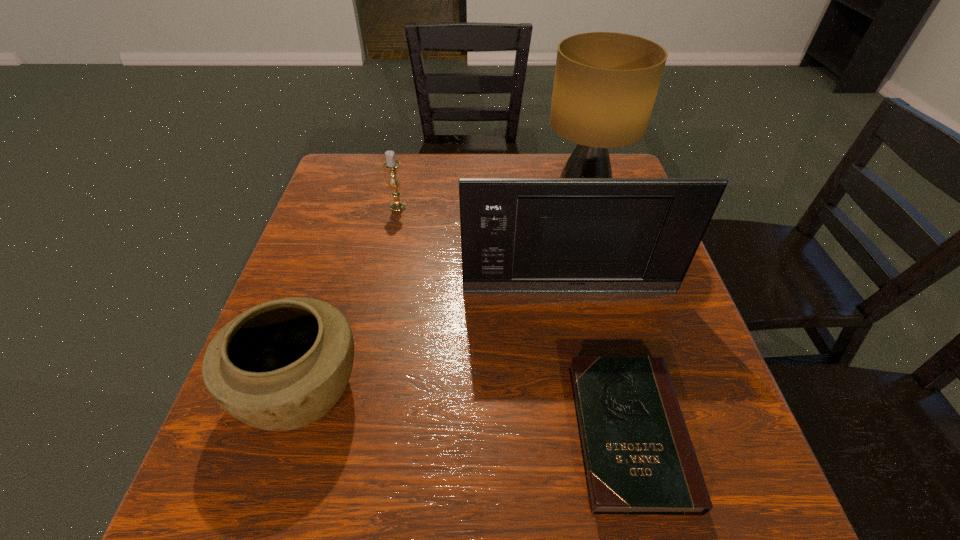
Where is `object that is the second closest to the Bible`? The width and height of the screenshot is (960, 540). object that is the second closest to the Bible is located at coordinates (281, 365).

Image resolution: width=960 pixels, height=540 pixels. I want to click on object that stands as the closest to the second tallest object, so click(638, 456).

Identify the location of vacant space that satisfies the following two spatial constraints: 1. on the back side of the tallest object; 2. on the left side of the Bible. (572, 198).

What are the coordinates of `vacant area in the image that satisfies the following two spatial constraints: 1. on the front panel of the microwave oven; 2. on the right side of the shortest object` in the screenshot? It's located at (596, 433).

Where is `free spot that satisfies the following two spatial constraints: 1. on the front side of the Bible; 2. on the right side of the candle holder`? free spot that satisfies the following two spatial constraints: 1. on the front side of the Bible; 2. on the right side of the candle holder is located at coordinates click(x=350, y=433).

At what (x,y) coordinates should I click in order to perform the action: click on free region that satisfies the following two spatial constraints: 1. on the back side of the shortest object; 2. on the left side of the lampshade. Please return your answer as a coordinate pair (x, y). Looking at the image, I should click on pyautogui.click(x=572, y=198).

You are a GUI agent. You are given a task and a screenshot of the screen. Output one action in this format:
    pyautogui.click(x=<x>, y=<y>)
    Task: Click on the free location that satisfies the following two spatial constraints: 1. on the back side of the lampshade; 2. on the right side of the candle holder
    The width and height of the screenshot is (960, 540).
    Given the screenshot: What is the action you would take?
    pyautogui.click(x=400, y=198)

Locate an element on the screen. Image resolution: width=960 pixels, height=540 pixels. free spot that satisfies the following two spatial constraints: 1. on the back side of the lampshade; 2. on the left side of the pottery is located at coordinates (361, 198).